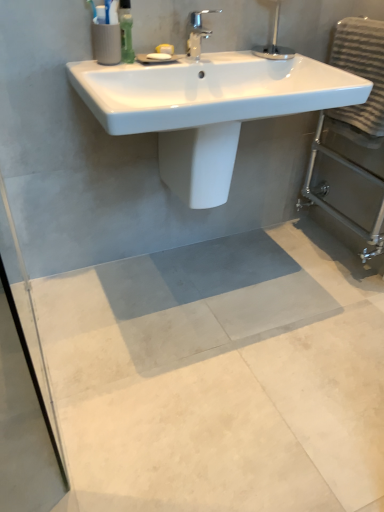
Question: Is gray concrete mat at center located outside white glossy bidet at center?

Choices:
 (A) no
 (B) yes

Answer: (B)

Question: From the image's perspective, would you say gray concrete mat at center is shown under white glossy bidet at center?

Choices:
 (A) no
 (B) yes

Answer: (B)

Question: Is the position of gray concrete mat at center less distant than that of white glossy bidet at center?

Choices:
 (A) no
 (B) yes

Answer: (B)

Question: Considering the relative sizes of gray concrete mat at center and white glossy bidet at center in the image provided, is gray concrete mat at center smaller than white glossy bidet at center?

Choices:
 (A) yes
 (B) no

Answer: (B)

Question: Does gray concrete mat at center have a lesser width compared to white glossy bidet at center?

Choices:
 (A) no
 (B) yes

Answer: (A)

Question: Are gray concrete mat at center and white glossy bidet at center far apart?

Choices:
 (A) no
 (B) yes

Answer: (A)

Question: Considering the relative positions of gray textured towel at right and chrome metallic faucet at upper center in the image provided, is gray textured towel at right to the left of chrome metallic faucet at upper center from the viewer's perspective?

Choices:
 (A) yes
 (B) no

Answer: (B)

Question: Is gray textured towel at right next to chrome metallic faucet at upper center?

Choices:
 (A) no
 (B) yes

Answer: (A)

Question: Is gray textured towel at right not within chrome metallic faucet at upper center?

Choices:
 (A) no
 (B) yes

Answer: (B)

Question: Is chrome metallic faucet at upper center completely or partially inside gray textured towel at right?

Choices:
 (A) yes
 (B) no

Answer: (B)

Question: Considering the relative sizes of gray textured towel at right and chrome metallic faucet at upper center in the image provided, is gray textured towel at right smaller than chrome metallic faucet at upper center?

Choices:
 (A) yes
 (B) no

Answer: (B)

Question: Is gray textured towel at right to the right of chrome metallic faucet at upper center from the viewer's perspective?

Choices:
 (A) no
 (B) yes

Answer: (B)

Question: From a real-world perspective, is gray concrete mat at center physically below white glossy sink at upper center?

Choices:
 (A) no
 (B) yes

Answer: (B)